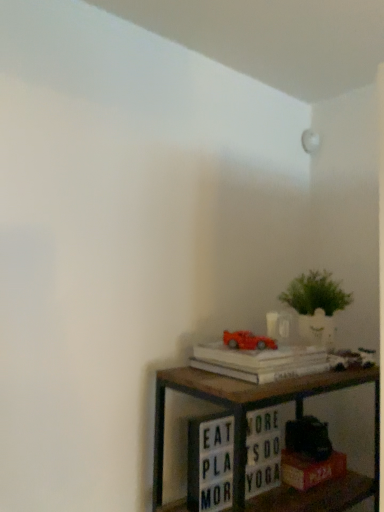
Question: Is wooden shelf at lower right inside the boundaries of shiny plastic car at upper right, or outside?

Choices:
 (A) outside
 (B) inside

Answer: (A)

Question: Considering the positions of wooden shelf at lower right and shiny plastic car at upper right in the image, is wooden shelf at lower right bigger or smaller than shiny plastic car at upper right?

Choices:
 (A) big
 (B) small

Answer: (A)

Question: Which object is the closest to the wooden shelf at lower right?

Choices:
 (A) shiny plastic car at upper right
 (B) hardcover book at lower right, the second paperback book positioned from the top
 (C) green leafy plant in white pot at lower right
 (D) white paper at upper right, positioned as the 2th paperback book in bottom-to-top order

Answer: (D)

Question: Estimate the real-world distances between objects in this image. Which object is closer to the hardcover book at lower right, the second paperback book positioned from the top?

Choices:
 (A) white paper at upper right, arranged as the first paperback book when viewed from the top
 (B) shiny plastic car at upper right
 (C) green leafy plant in white pot at lower right
 (D) wooden shelf at lower right

Answer: (D)